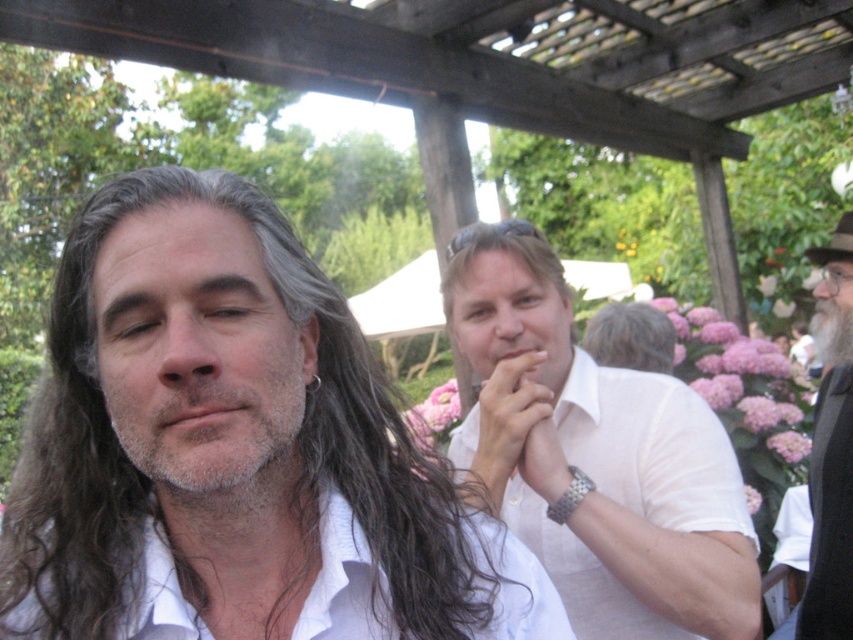
Who is higher up, white matte shirt at center or gray beard at right?

Positioned higher is white matte shirt at center.

Is point (486, 310) closer to viewer compared to point (809, 480)?

Yes, point (486, 310) is closer to viewer.

Where is `white matte shirt at center`? Image resolution: width=853 pixels, height=640 pixels. white matte shirt at center is located at coordinates (595, 456).

From the picture: Who is positioned more to the left, gray beard at right or matte white hand at center?

From the viewer's perspective, matte white hand at center appears more on the left side.

Can you confirm if gray beard at right is thinner than matte white hand at center?

In fact, gray beard at right might be wider than matte white hand at center.

Locate an element on the screen. Image resolution: width=853 pixels, height=640 pixels. gray beard at right is located at coordinates click(831, 448).

This screenshot has width=853, height=640. Find the location of `gray beard at right`. gray beard at right is located at coordinates (831, 448).

The image size is (853, 640). What are the coordinates of `graysoftbeard at center` in the screenshot? It's located at (207, 412).

Does graysoftbeard at center appear over gray matte hair at center?

Incorrect, graysoftbeard at center is not positioned above gray matte hair at center.

Which is behind, point (213, 224) or point (659, 358)?

The point (659, 358) is behind.

Locate an element on the screen. The image size is (853, 640). graysoftbeard at center is located at coordinates (207, 412).